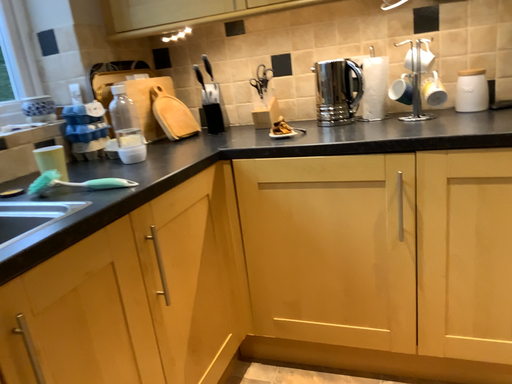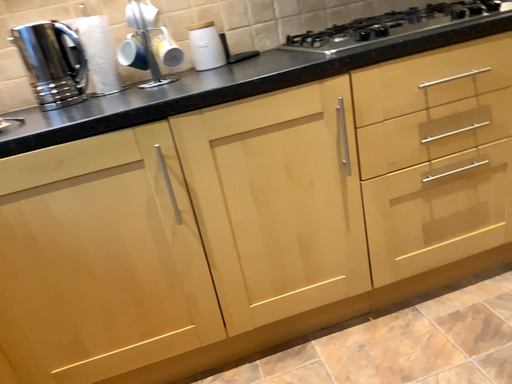
Question: How did the camera likely rotate when shooting the video?

Choices:
 (A) rotated left
 (B) rotated right

Answer: (B)